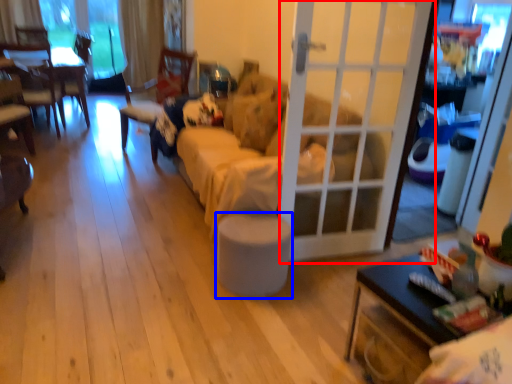
Question: Which point is further to the camera, door (highlighted by a red box) or stool (highlighted by a blue box)?

Choices:
 (A) door
 (B) stool

Answer: (B)